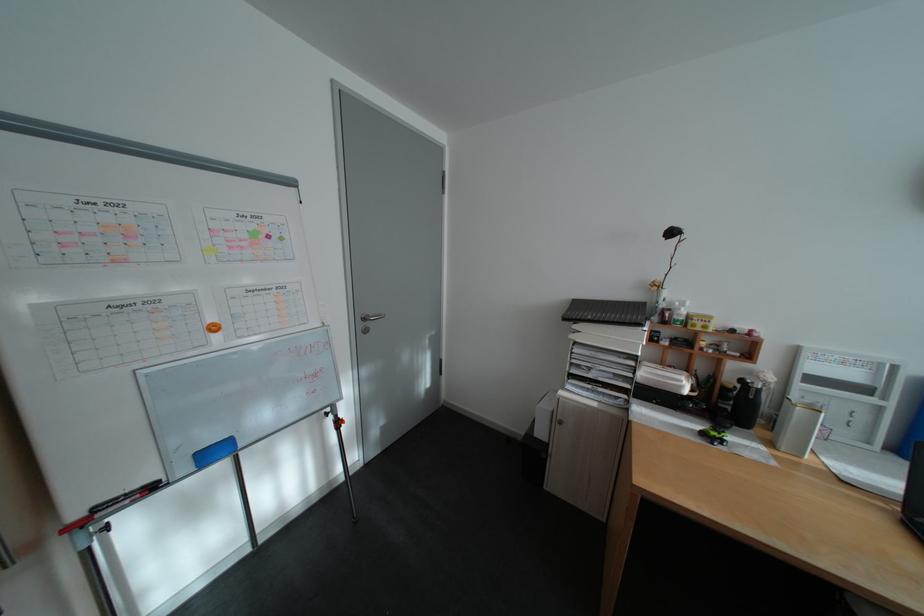
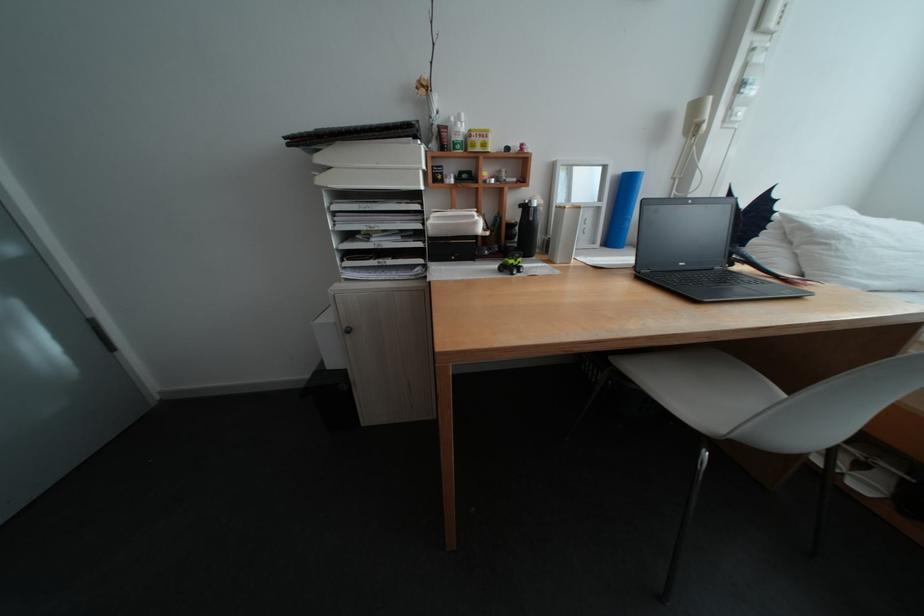
Locate, in the second image, the point that corresponds to the point at 589,328 in the first image.

(333, 160)